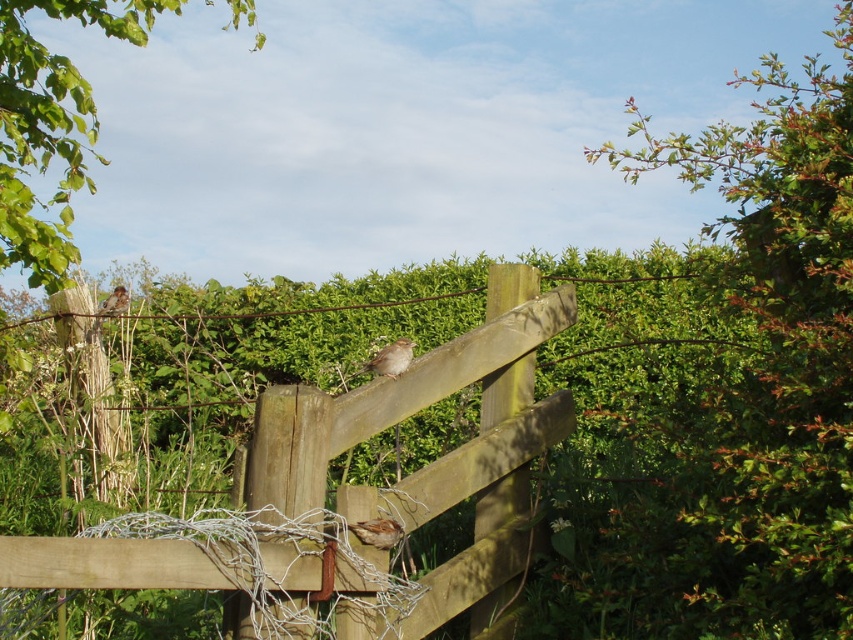
You are a birdwatcher standing in front of the wooden gate. You notice a brown matte sparrow at upper left and a wooden fence at center. Which object is positioned to the right of the other?

The wooden fence at center is to the right of the brown matte sparrow at upper left.

You are a birdwatcher observing the rustic outdoor scene. You notice the wooden fence at center and the brown matte sparrow at upper left. Which object is positioned higher in the image?

The brown matte sparrow at upper left is positioned higher than the wooden fence at center.